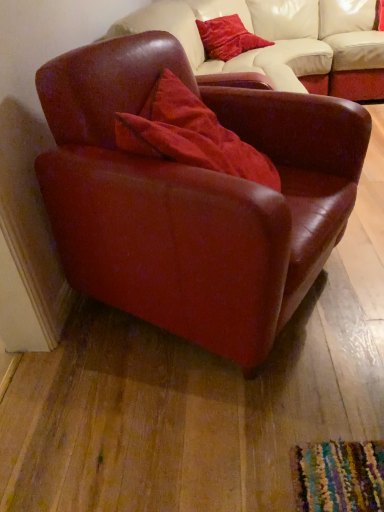
Question: Is the position of velvet red pillow at upper center, the first pillow positioned from the back, more distant than that of velvet red pillow at center, the 1th pillow when ordered from bottom to top?

Choices:
 (A) no
 (B) yes

Answer: (B)

Question: Is velvet red pillow at upper center, which is counted as the first pillow, starting from the top, smaller than velvet red pillow at center, which ranks as the second pillow in back-to-front order?

Choices:
 (A) yes
 (B) no

Answer: (A)

Question: Does velvet red pillow at upper center, the second pillow when ordered from bottom to top, have a larger size compared to velvet red pillow at center, placed as the first pillow when sorted from front to back?

Choices:
 (A) yes
 (B) no

Answer: (B)

Question: Is velvet red pillow at upper center, the second pillow when ordered from bottom to top, oriented towards velvet red pillow at center, the 1th pillow when ordered from bottom to top?

Choices:
 (A) no
 (B) yes

Answer: (A)

Question: Is velvet red pillow at upper center, the first pillow positioned from the back, not within velvet red pillow at center, which ranks as the second pillow in back-to-front order?

Choices:
 (A) no
 (B) yes

Answer: (B)

Question: From a real-world perspective, is velvet red pillow at upper center, marked as the 2th pillow in a front-to-back arrangement, above or below matte leather armchair at center?

Choices:
 (A) below
 (B) above

Answer: (B)

Question: Is point (240, 50) closer or farther from the camera than point (87, 148)?

Choices:
 (A) farther
 (B) closer

Answer: (A)

Question: Considering their positions, is velvet red pillow at upper center, marked as the 2th pillow in a front-to-back arrangement, located in front of or behind matte leather armchair at center?

Choices:
 (A) behind
 (B) front

Answer: (A)

Question: Is velvet red pillow at upper center, the second pillow when ordered from bottom to top, to the left or to the right of matte leather armchair at center in the image?

Choices:
 (A) left
 (B) right

Answer: (B)

Question: In terms of height, does matte leather armchair at center look taller or shorter compared to velvet red pillow at upper center, the second pillow when ordered from bottom to top?

Choices:
 (A) tall
 (B) short

Answer: (A)

Question: From the image's perspective, is matte leather armchair at center located above or below velvet red pillow at upper center, marked as the 2th pillow in a front-to-back arrangement?

Choices:
 (A) below
 (B) above

Answer: (A)

Question: Considering their positions, is matte leather armchair at center located in front of or behind velvet red pillow at upper center, marked as the 2th pillow in a front-to-back arrangement?

Choices:
 (A) front
 (B) behind

Answer: (A)

Question: From a real-world perspective, is matte leather armchair at center positioned above or below velvet red pillow at upper center, the first pillow positioned from the back?

Choices:
 (A) below
 (B) above

Answer: (A)

Question: Is point (145, 133) positioned closer to the camera than point (205, 45)?

Choices:
 (A) farther
 (B) closer

Answer: (B)

Question: Relative to velvet red pillow at upper center, marked as the 2th pillow in a front-to-back arrangement, is velvet red pillow at center, the 1th pillow when ordered from bottom to top, in front or behind?

Choices:
 (A) behind
 (B) front

Answer: (B)